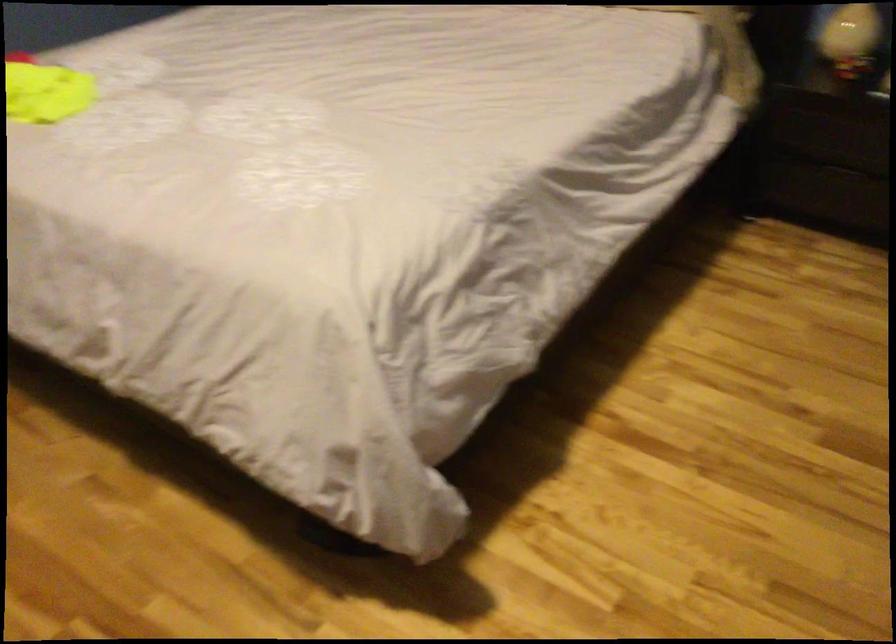
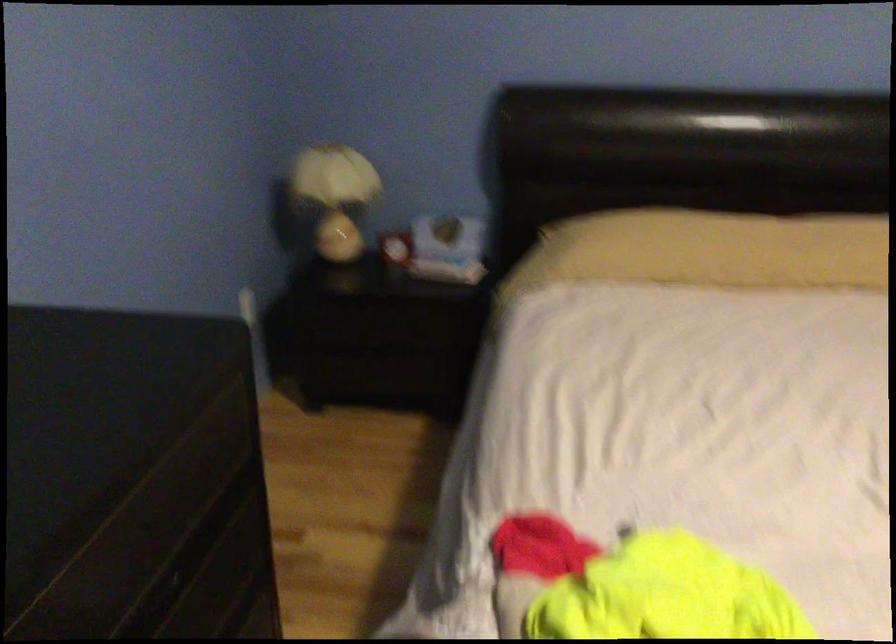
The images are taken continuously from a first-person perspective. In which direction are you moving?

The cameraman moved toward left, forward.